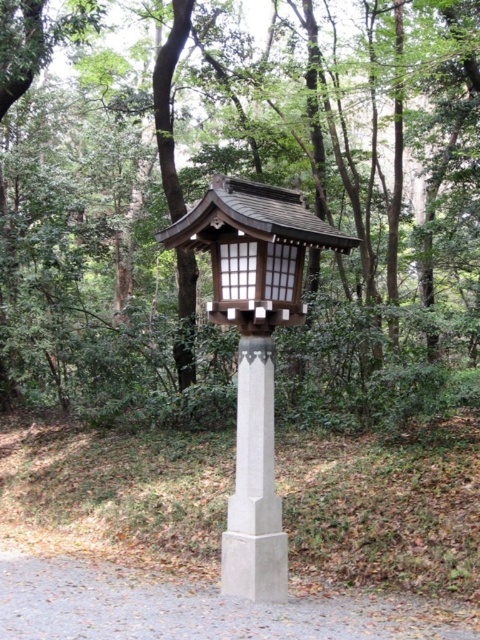
Question: Which point is closer to the camera?

Choices:
 (A) (294, 376)
 (B) (273, 461)

Answer: (B)

Question: Among these points, which one is farthest from the camera?

Choices:
 (A) (271, 536)
 (B) (337, 248)

Answer: (B)

Question: Does green leafy tree at center appear on the right side of matte wood lantern at center?

Choices:
 (A) no
 (B) yes

Answer: (A)

Question: Estimate the real-world distances between objects in this image. Which object is farther from the gray concrete post at center?

Choices:
 (A) green leafy tree at center
 (B) matte wood lantern at center

Answer: (A)

Question: Can you confirm if green leafy tree at center is positioned below gray concrete post at center?

Choices:
 (A) no
 (B) yes

Answer: (A)

Question: Is green leafy tree at center closer to the viewer compared to gray concrete post at center?

Choices:
 (A) no
 (B) yes

Answer: (B)